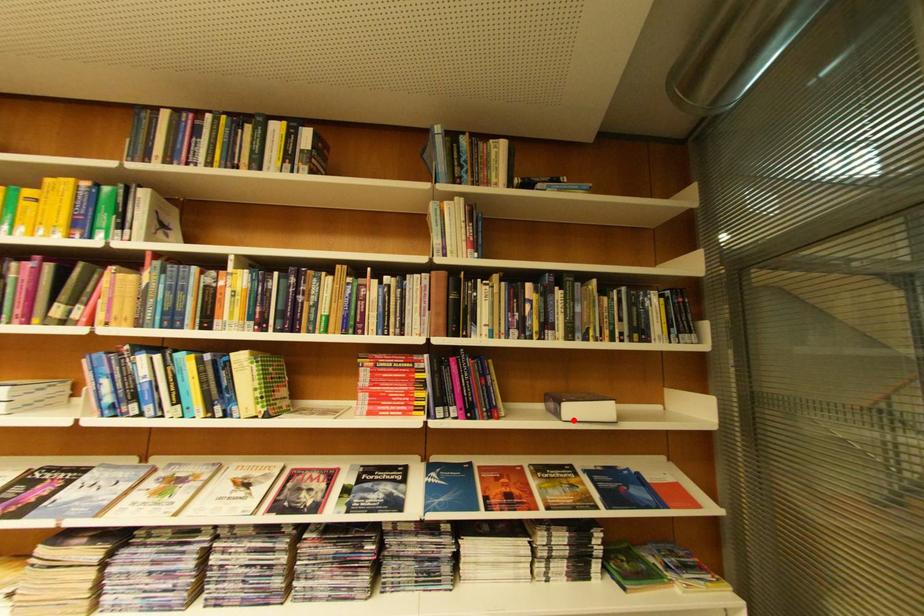
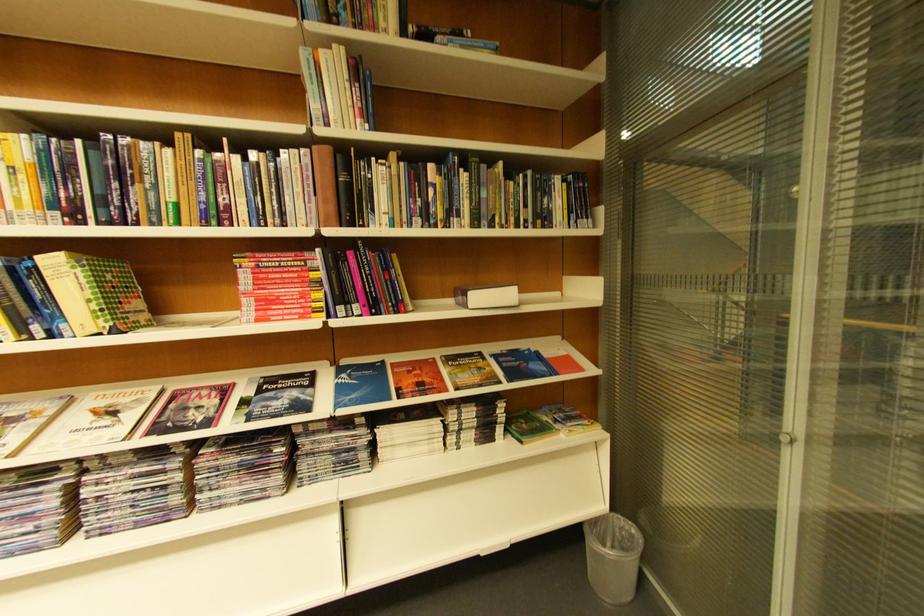
In the second image, find the point that corresponds to the highlighted location in the first image.

(480, 309)